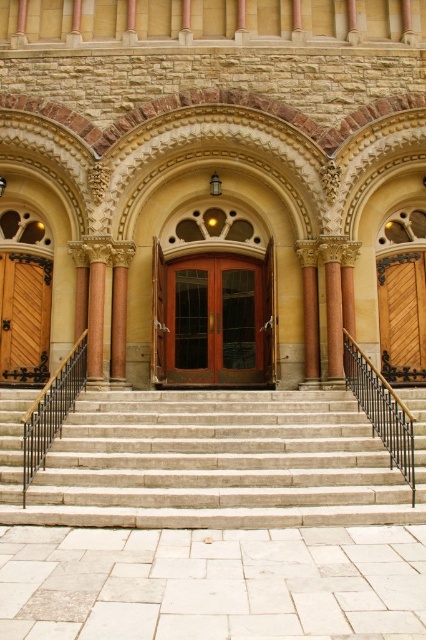
How far apart are wooden door at right and polished bronze column at center?

They are 21.06 meters apart.

Which is below, wooden door at right or polished bronze column at center?

polished bronze column at center is lower down.

You are a GUI agent. You are given a task and a screenshot of the screen. Output one action in this format:
    pyautogui.click(x=<x>, y=<y>)
    Task: Click on the wooden door at right
    
    Given the screenshot: What is the action you would take?
    pyautogui.click(x=402, y=316)

Is point (230, 336) positioned before point (388, 424)?

No, it is behind (388, 424).

Which is behind, point (176, 307) or point (394, 454)?

Positioned behind is point (176, 307).

At what (x,y) coordinates should I click in order to perform the action: click on mahogany wood door at center. Please return your answer as a coordinate pair (x, y). This screenshot has height=640, width=426. Looking at the image, I should click on (213, 320).

Is wooden door at left shorter than polished bronze column at center?

In fact, wooden door at left may be taller than polished bronze column at center.

Which of these two, wooden door at left or polished bronze column at center, stands shorter?

With less height is polished bronze column at center.

Does point (14, 368) come in front of point (118, 342)?

No, it is behind (118, 342).

At what (x,y) coordinates should I click in order to perform the action: click on wooden door at left. Please return your answer as a coordinate pair (x, y). This screenshot has height=640, width=426. Looking at the image, I should click on (25, 317).